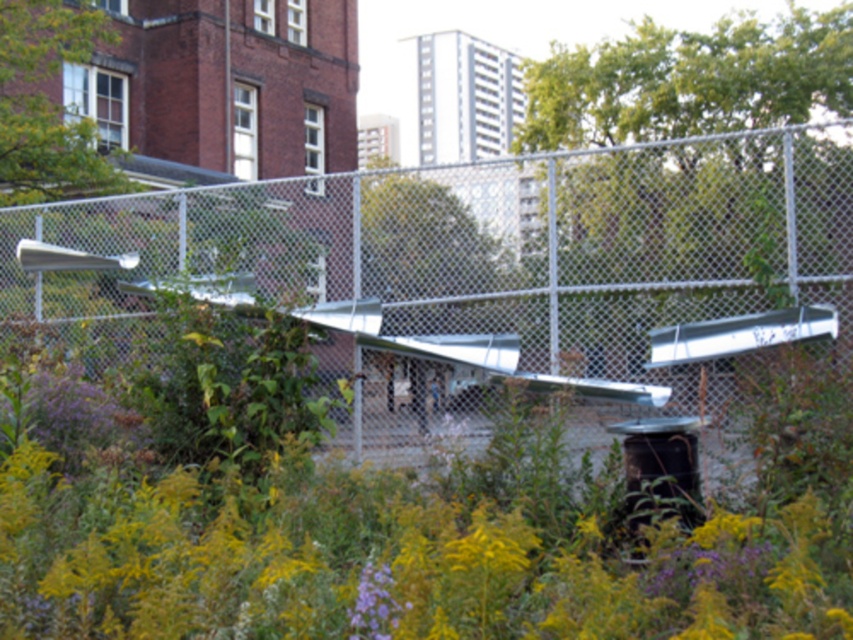
Question: Can you confirm if silver chain-link fence at center is positioned to the right of purple matte flower at center?

Choices:
 (A) yes
 (B) no

Answer: (A)

Question: Is silver chain-link fence at center wider than purple matte flower at center?

Choices:
 (A) yes
 (B) no

Answer: (A)

Question: Is silver chain-link fence at center bigger than purple matte flower at center?

Choices:
 (A) yes
 (B) no

Answer: (A)